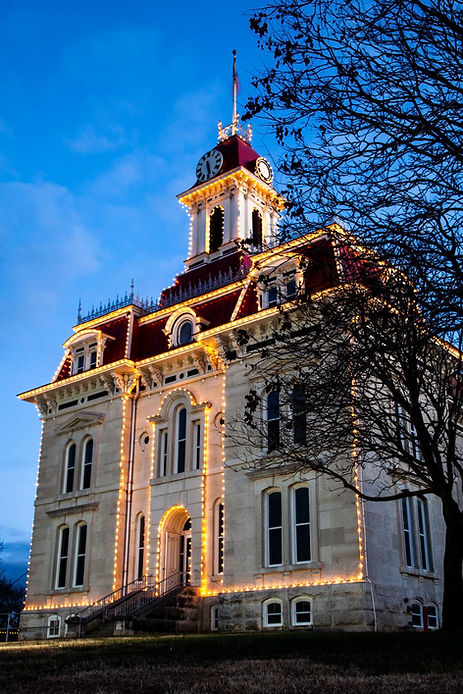
The width and height of the screenshot is (463, 694). I want to click on stairs, so click(x=105, y=624).